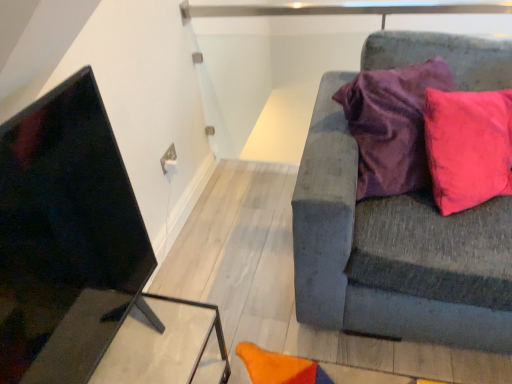
Question: In terms of width, does textured gray couch at right look wider or thinner when compared to matte black table at lower left?

Choices:
 (A) thin
 (B) wide

Answer: (B)

Question: Considering the positions of textured gray couch at right and matte black table at lower left in the image, is textured gray couch at right bigger or smaller than matte black table at lower left?

Choices:
 (A) big
 (B) small

Answer: (A)

Question: Considering their positions, is textured gray couch at right located in front of or behind matte black table at lower left?

Choices:
 (A) behind
 (B) front

Answer: (B)

Question: Is matte black table at lower left taller or shorter than textured gray couch at right?

Choices:
 (A) short
 (B) tall

Answer: (A)

Question: From a real-world perspective, is matte black table at lower left above or below textured gray couch at right?

Choices:
 (A) below
 (B) above

Answer: (A)

Question: From the image's perspective, is matte black table at lower left positioned above or below textured gray couch at right?

Choices:
 (A) above
 (B) below

Answer: (B)

Question: In the image, is matte black table at lower left positioned in front of or behind textured gray couch at right?

Choices:
 (A) behind
 (B) front

Answer: (A)